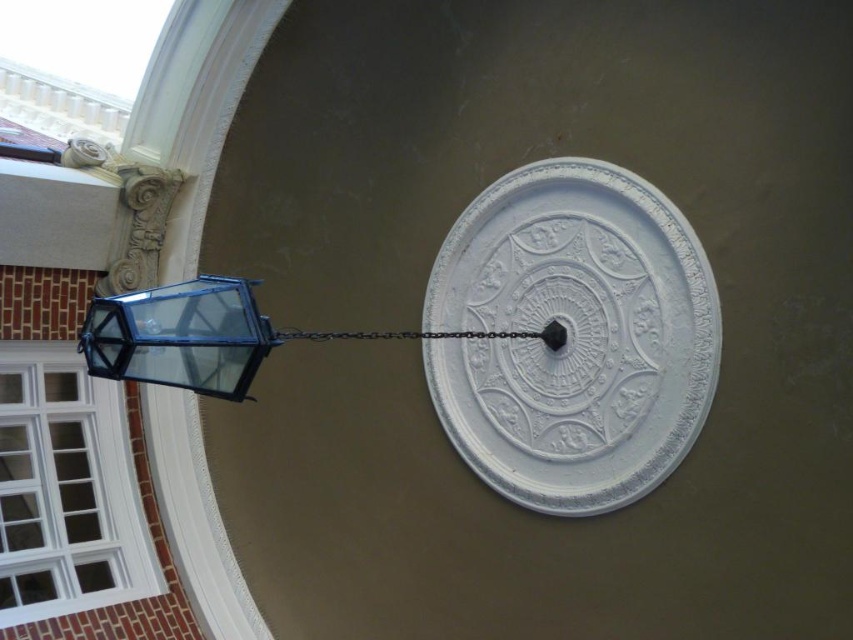
Question: Which object is closer to the camera taking this photo?

Choices:
 (A) black metal chain at center
 (B) blue glass lantern at upper left

Answer: (A)

Question: Does white textured clock at center appear on the right side of black metal chain at center?

Choices:
 (A) yes
 (B) no

Answer: (A)

Question: Is white textured clock at center in front of blue glass lantern at upper left?

Choices:
 (A) yes
 (B) no

Answer: (A)

Question: Which point is farther from the camera taking this photo?

Choices:
 (A) click(x=198, y=378)
 (B) click(x=376, y=332)

Answer: (B)

Question: Which of these objects is positioned farthest from the blue glass lantern at upper left?

Choices:
 (A) white textured clock at center
 (B) black metal chain at center
 (C) matte glass lantern at left

Answer: (C)

Question: Is the position of white textured clock at center more distant than that of matte glass lantern at left?

Choices:
 (A) no
 (B) yes

Answer: (B)